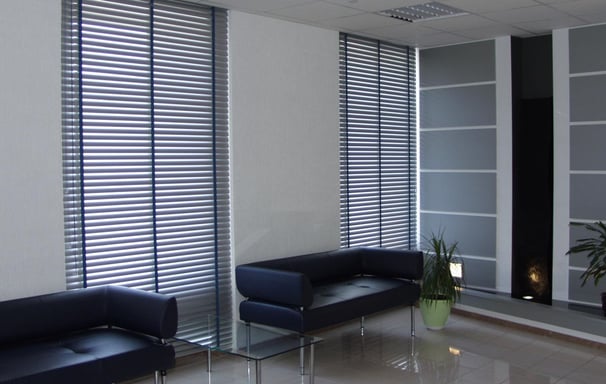
You are a GUI agent. You are given a task and a screenshot of the screen. Output one action in this format:
    pyautogui.click(x=<x>, y=<y>)
    Task: Click on the light source
    
    Given the screenshot: What is the action you would take?
    pyautogui.click(x=456, y=278)